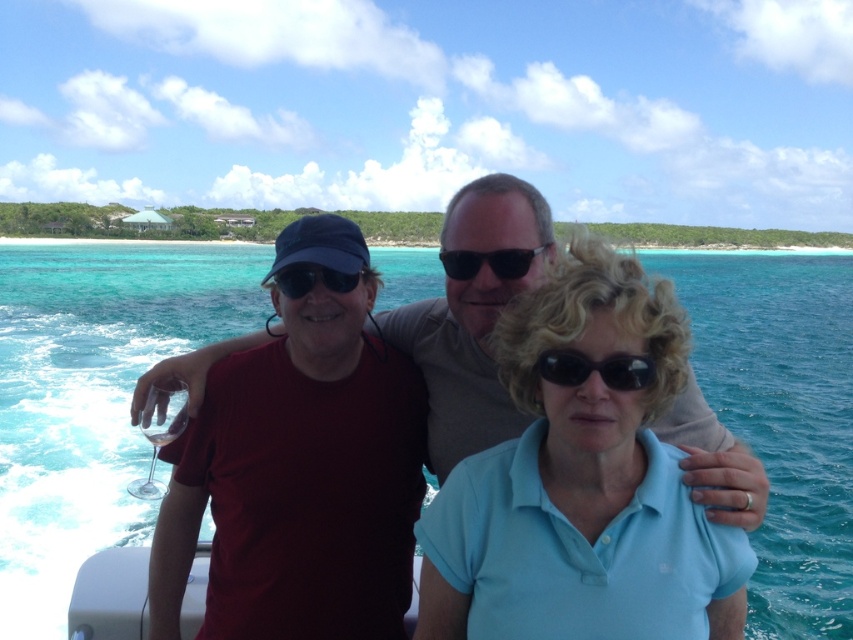
You are a photographer on the boat and want to capture a closeup of the black reflective sunglasses at center and the matte black goggles at center. Which object should you focus on first to ensure both are in focus?

The black reflective sunglasses at center is closer to the viewer than the matte black goggles at center, so focus on the black reflective sunglasses at center first to ensure both are in focus.

You are a photographer trying to capture a clear shot of the black reflective sunglasses at center and the matte black goggles at center. Which object is located to the right of the other?

The black reflective sunglasses at center is positioned on the right side of matte black goggles at center.